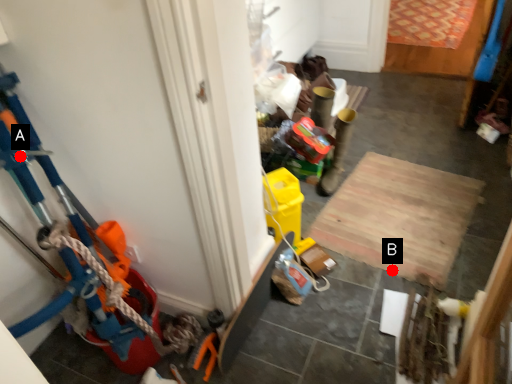
Question: Two points are circled on the image, labeled by A and B beside each circle. Which point is farther from the camera taking this photo?

Choices:
 (A) A is further
 (B) B is further

Answer: (B)